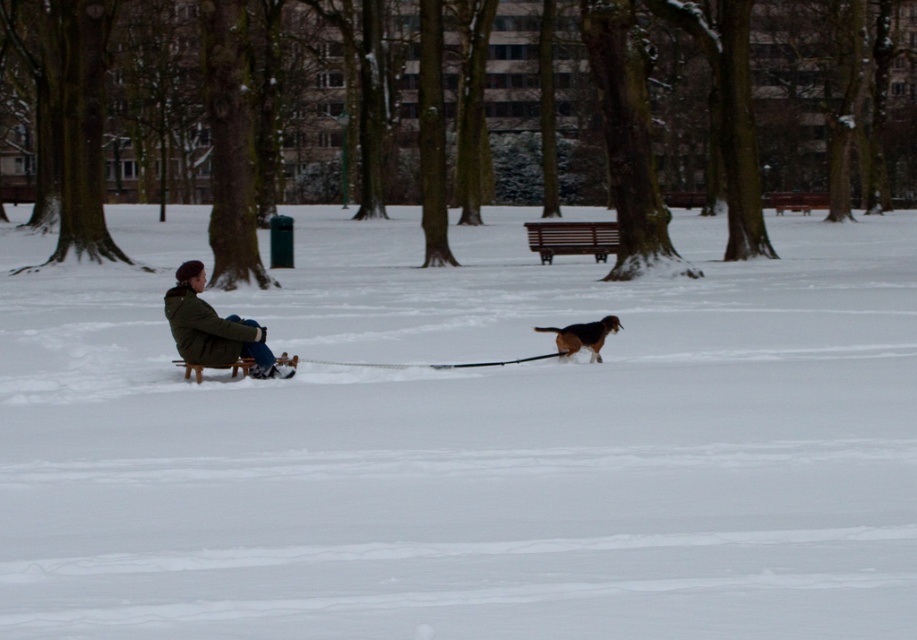
Locate an element on the screen. The width and height of the screenshot is (917, 640). white fluffy snow at center is located at coordinates coord(467,442).

Can you confirm if white fluffy snow at center is taller than green matte jacket at left?

Indeed, white fluffy snow at center has a greater height compared to green matte jacket at left.

You are a GUI agent. You are given a task and a screenshot of the screen. Output one action in this format:
    pyautogui.click(x=<x>, y=<y>)
    Task: Click on the white fluffy snow at center
    The image size is (917, 640).
    Given the screenshot: What is the action you would take?
    pyautogui.click(x=467, y=442)

Where is `white fluffy snow at center`? This screenshot has height=640, width=917. white fluffy snow at center is located at coordinates (467, 442).

From the picture: Does white fluffy snow at center appear on the left side of brown fur dog at center?

Indeed, white fluffy snow at center is positioned on the left side of brown fur dog at center.

Is point (253, 472) positioned in front of point (567, 342)?

Yes, it is.

Measure the distance between point (261,552) and camera.

Point (261,552) is 9.19 meters away from camera.

Where is `white fluffy snow at center`? This screenshot has width=917, height=640. white fluffy snow at center is located at coordinates (467, 442).

Describe the element at coordinates (214, 328) in the screenshot. I see `green matte jacket at left` at that location.

Who is positioned more to the left, green matte jacket at left or brown fur dog at center?

green matte jacket at left

Is point (203, 330) farther from camera compared to point (590, 342)?

No, (203, 330) is in front of (590, 342).

Locate an element on the screen. The width and height of the screenshot is (917, 640). green matte jacket at left is located at coordinates (214, 328).